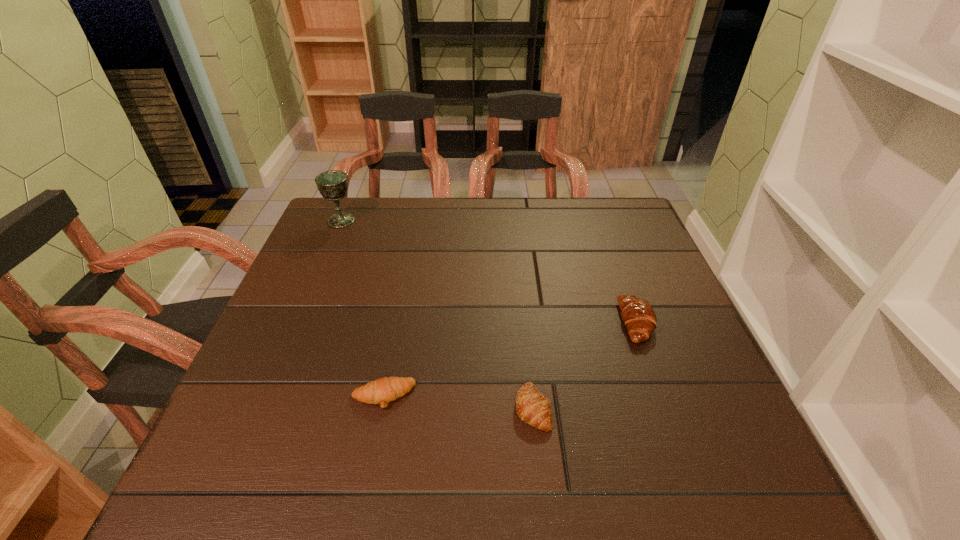
Find the location of a particular element. the tallest object is located at coordinates (333, 185).

Identify the location of chalice. (333, 185).

What are the coordinates of `the rightmost object` in the screenshot? It's located at (637, 314).

At what (x,y) coordinates should I click in order to perform the action: click on the second farthest object. Please return your answer as a coordinate pair (x, y). The image size is (960, 540). Looking at the image, I should click on pos(637,314).

Where is `the second crescent roll from right to left`? the second crescent roll from right to left is located at coordinates (532, 407).

At what (x,y) coordinates should I click in order to perform the action: click on the leftmost crescent roll. Please return your answer as a coordinate pair (x, y). The width and height of the screenshot is (960, 540). Looking at the image, I should click on (381, 391).

What are the coordinates of `vacant space located 0.190m on the front of the farthest object` in the screenshot? It's located at (320, 271).

At what (x,y) coordinates should I click in order to perform the action: click on free space located 0.270m on the front of the second farthest object. Please return your answer as a coordinate pair (x, y). The image size is (960, 540). Looking at the image, I should click on (690, 471).

The width and height of the screenshot is (960, 540). I want to click on vacant space positioned on the back of the second crescent roll from left to right, so click(x=527, y=356).

The width and height of the screenshot is (960, 540). What are the coordinates of `vacant space located on the back of the second object from left to right` in the screenshot? It's located at (401, 301).